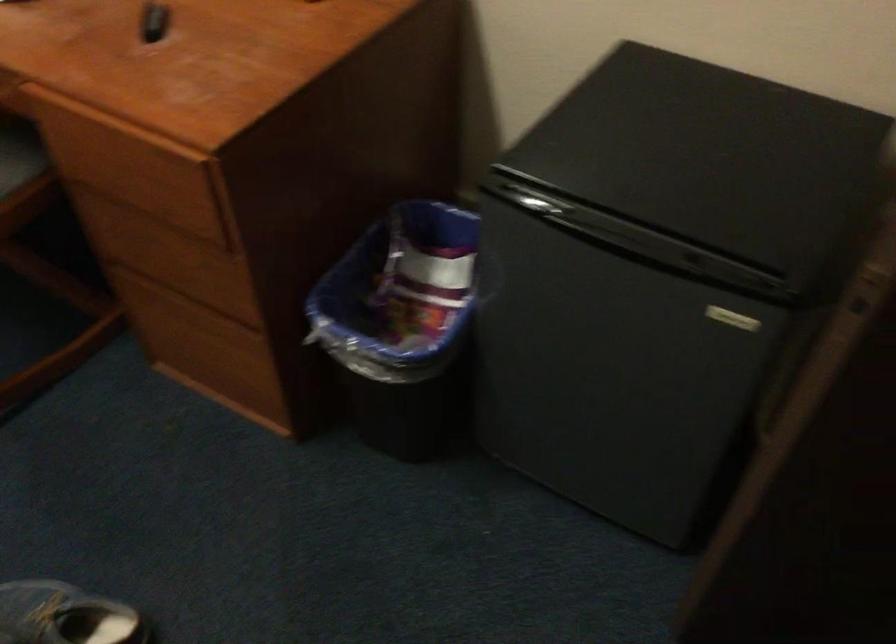
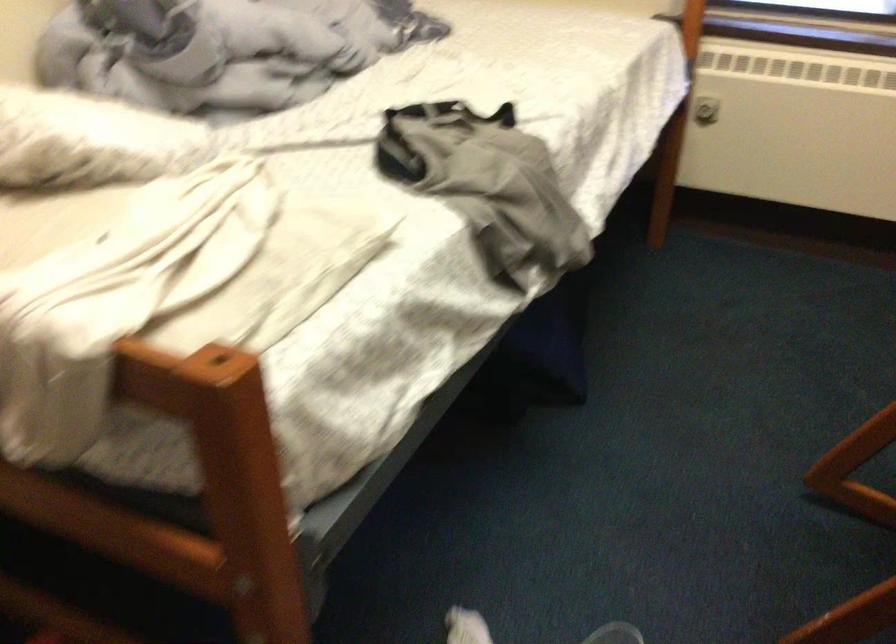
The images are taken continuously from a first-person perspective. In which direction is your viewpoint rotating?

The camera rotated toward left-down.